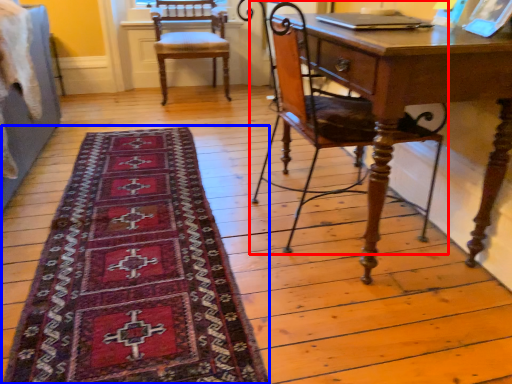
Question: Which object appears closest to the camera in this image, chair (highlighted by a red box) or mat (highlighted by a blue box)?

Choices:
 (A) chair
 (B) mat

Answer: (B)